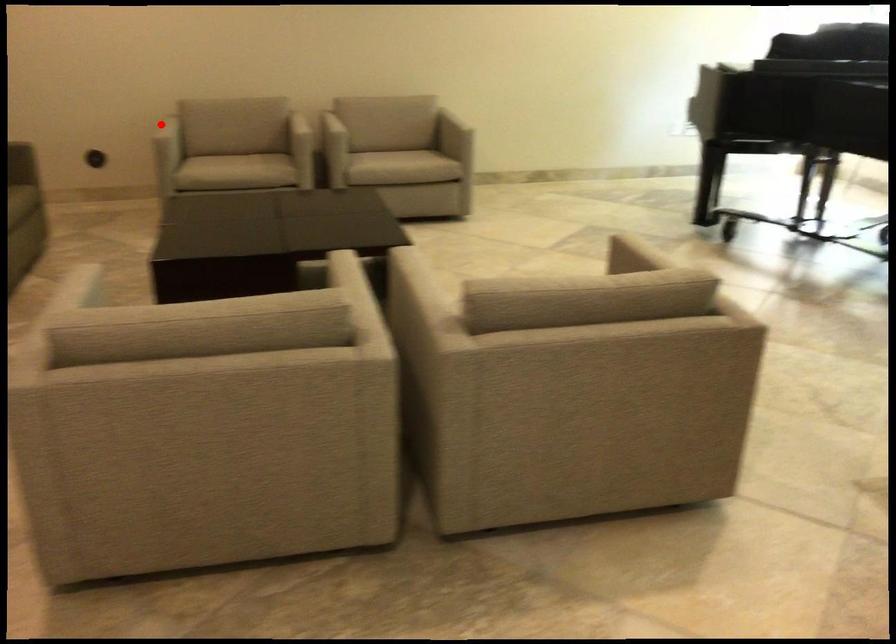
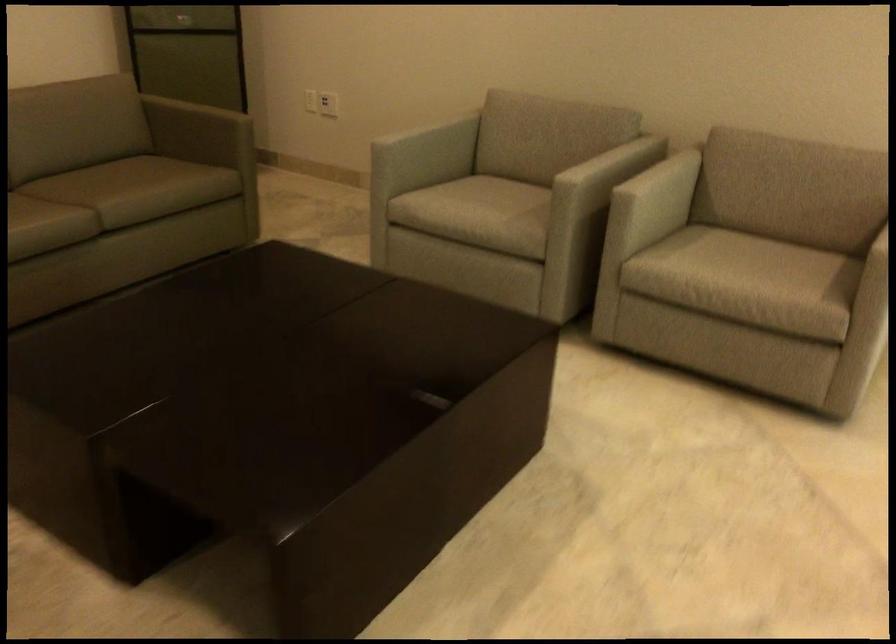
Question: I am providing you with two images of the same scene from different viewpoints. Image1 has a red point marked. In image2, the corresponding 3D location appears at what relative position? Reply with the corresponding letter.

Choices:
 (A) Closer
 (B) Farther

Answer: (A)